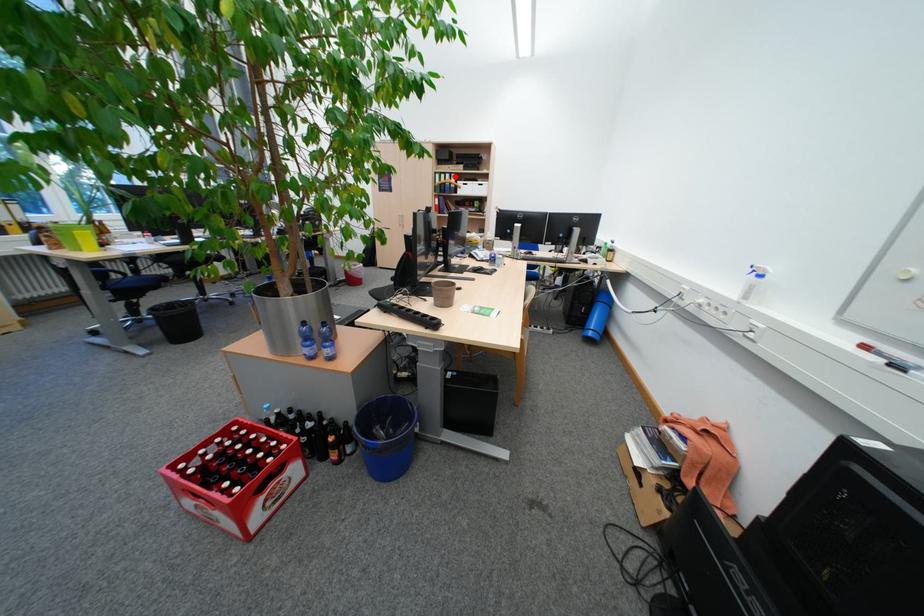
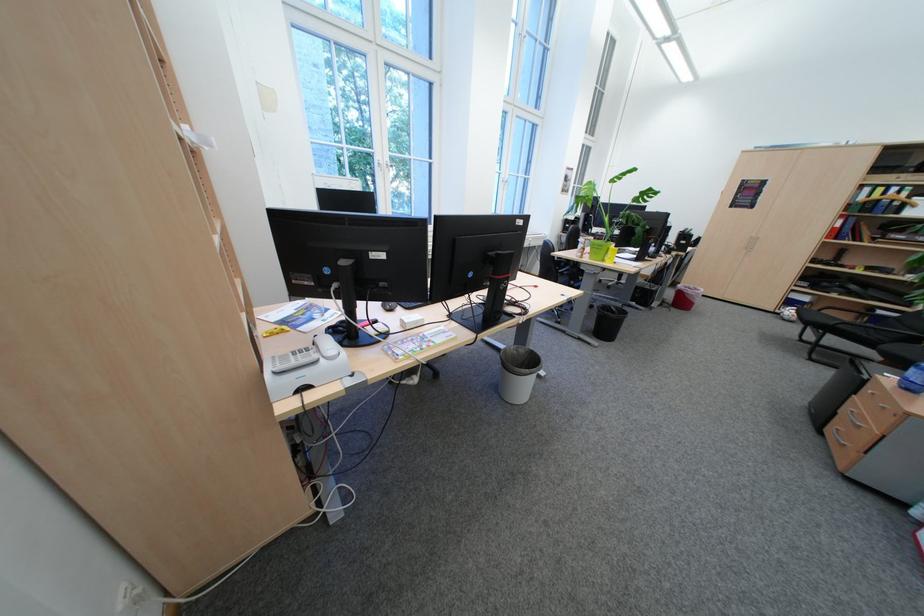
Find the pixel in the second image that matches the highlighted location in the first image.

(893, 190)